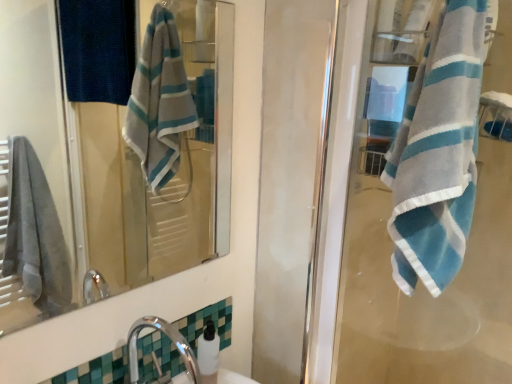
Question: Considering the positions of chrome metallic faucet at lower left and matte glass mirror at upper center in the image, is chrome metallic faucet at lower left taller or shorter than matte glass mirror at upper center?

Choices:
 (A) short
 (B) tall

Answer: (A)

Question: Do you think chrome metallic faucet at lower left is within matte glass mirror at upper center, or outside of it?

Choices:
 (A) outside
 (B) inside

Answer: (A)

Question: Estimate the real-world distances between objects in this image. Which object is farther from the blue striped towel at right?

Choices:
 (A) matte glass mirror at upper center
 (B) chrome metallic faucet at lower left
 (C) white glossy soap dispenser at lower center

Answer: (A)

Question: Considering the real-world distances, which object is closest to the chrome metallic faucet at lower left?

Choices:
 (A) matte glass mirror at upper center
 (B) white glossy soap dispenser at lower center
 (C) blue striped towel at right

Answer: (B)